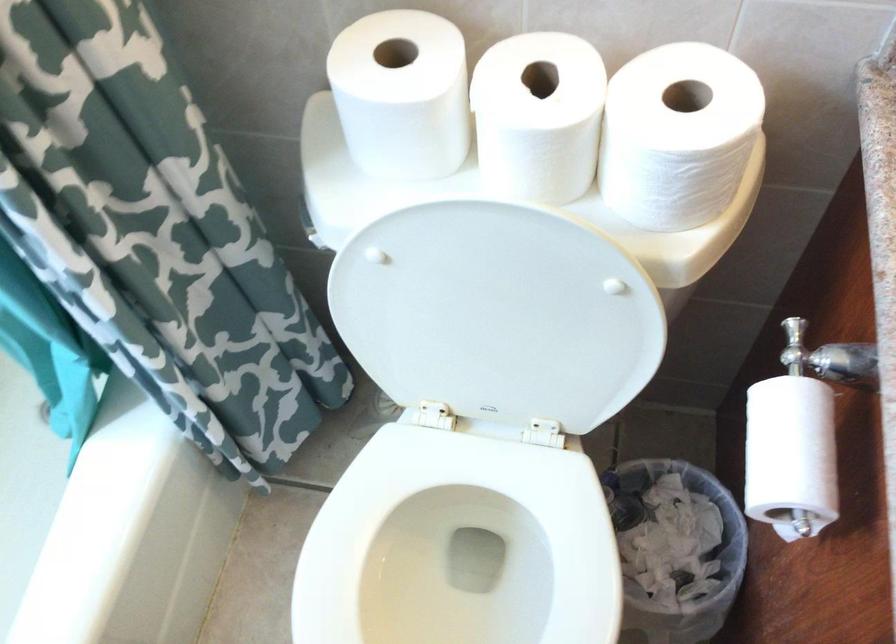
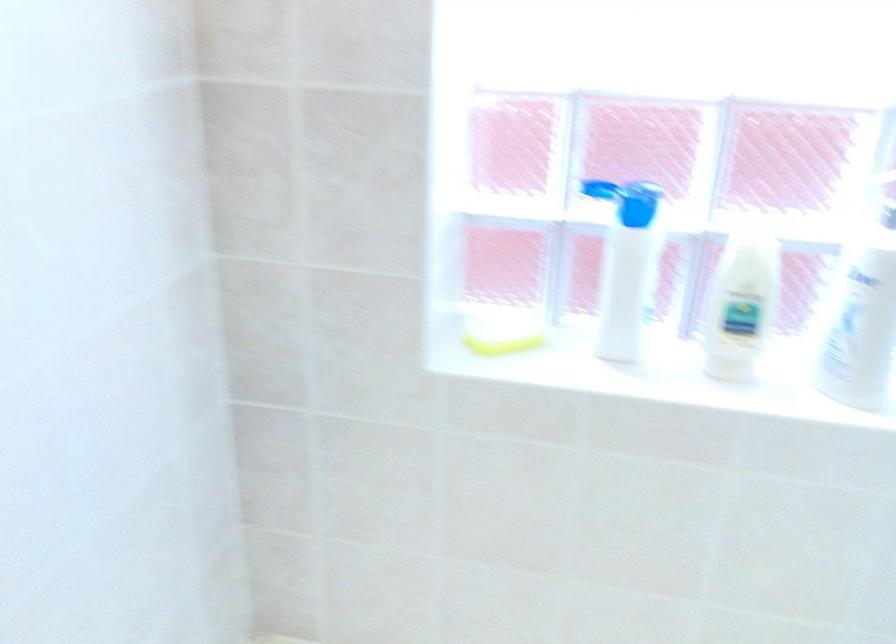
Consider the image. First-person continuous shooting, in which direction is the camera rotating?

The rotation direction of the camera is left-down.